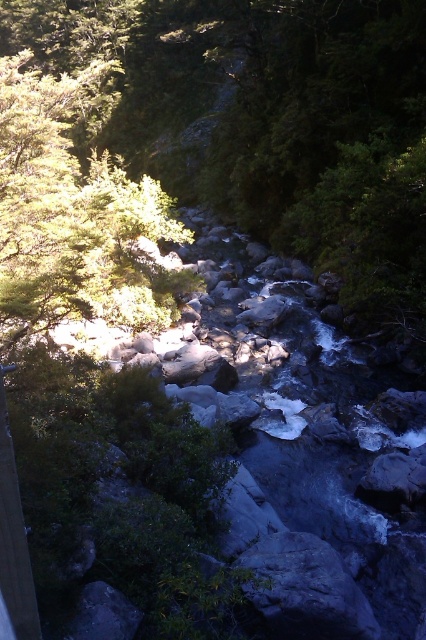
Question: Is green leafy tree at center positioned behind green matte tree at upper left?

Choices:
 (A) yes
 (B) no

Answer: (A)

Question: Among these points, which one is farthest from the camera?

Choices:
 (A) (178, 172)
 (B) (288, 557)

Answer: (A)

Question: Does green leafy tree at center have a lesser width compared to gray rock at center?

Choices:
 (A) yes
 (B) no

Answer: (B)

Question: Which of the following is the closest to the observer?

Choices:
 (A) green leafy tree at center
 (B) gray rock at center

Answer: (B)

Question: Which point appears farthest from the camera in this image?

Choices:
 (A) (311, 628)
 (B) (155, 140)
 (C) (39, 307)

Answer: (B)

Question: Does green matte tree at upper left appear over gray rock at center?

Choices:
 (A) no
 (B) yes

Answer: (B)